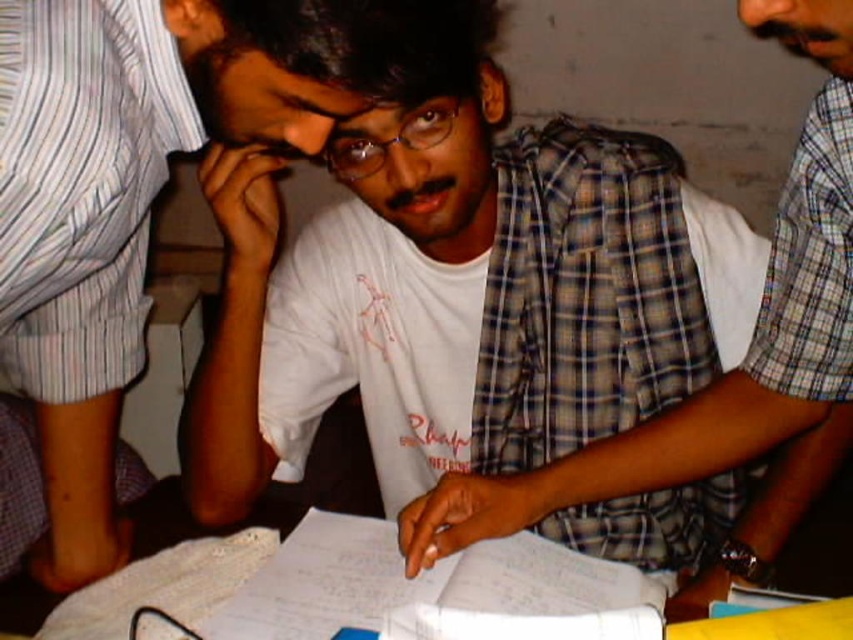
Is plaid fabric shirt at center to the right of white paper at center from the viewer's perspective?

Correct, you'll find plaid fabric shirt at center to the right of white paper at center.

Does plaid fabric shirt at center have a larger size compared to white paper at center?

Yes, plaid fabric shirt at center is bigger than white paper at center.

Is point (602, 451) behind point (482, 556)?

That is True.

Identify the location of plaid fabric shirt at center. (705, 406).

Who is shorter, white matte shirt at center or plaid fabric shirt at center?

Standing shorter between the two is plaid fabric shirt at center.

Can you confirm if white matte shirt at center is smaller than plaid fabric shirt at center?

Correct, white matte shirt at center occupies less space than plaid fabric shirt at center.

Is point (80, 3) positioned in front of point (846, 214)?

Yes, it is in front of point (846, 214).

At what (x,y) coordinates should I click in order to perform the action: click on white matte shirt at center. Please return your answer as a coordinate pair (x, y). Looking at the image, I should click on (125, 200).

Which is more to the left, white matte shirt at center or white paper at center?

white matte shirt at center is more to the left.

Is point (35, 396) behind point (448, 596)?

Yes, it is behind point (448, 596).

Between point (51, 483) and point (520, 579), which one is positioned behind?

The point (51, 483) is more distant.

Where is `white matte shirt at center`? The width and height of the screenshot is (853, 640). white matte shirt at center is located at coordinates (125, 200).